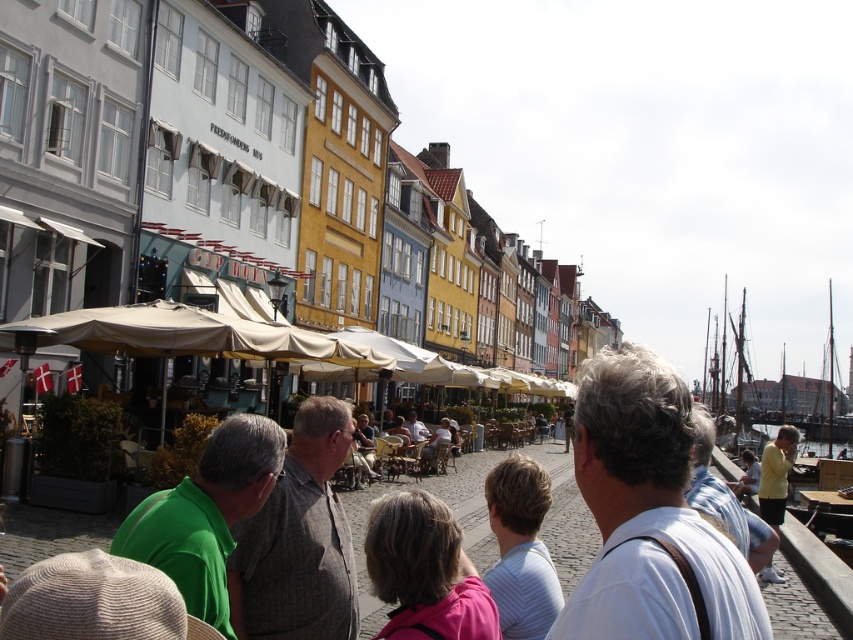
Question: In this image, where is green fabric shirt at center located relative to pink fabric at center?

Choices:
 (A) above
 (B) below

Answer: (A)

Question: Can you confirm if green fabric shirt at center is positioned above light brown wooden chair at center?

Choices:
 (A) no
 (B) yes

Answer: (B)

Question: Which object is farther from the camera taking this photo?

Choices:
 (A) pink fabric at center
 (B) yellow shirt at lower right
 (C) white fabric shirt at center

Answer: (B)

Question: Estimate the real-world distances between objects in this image. Which object is farther from the yellow cotton shirt at lower right?

Choices:
 (A) white fabric shirt at center
 (B) pink fabric at center
 (C) gray woolen sweater at center

Answer: (B)

Question: Is pink fabric at center behind yellow shirt at lower right?

Choices:
 (A) yes
 (B) no

Answer: (B)

Question: Among these objects, which one is nearest to the camera?

Choices:
 (A) yellow cotton shirt at lower right
 (B) pink fabric at center

Answer: (B)